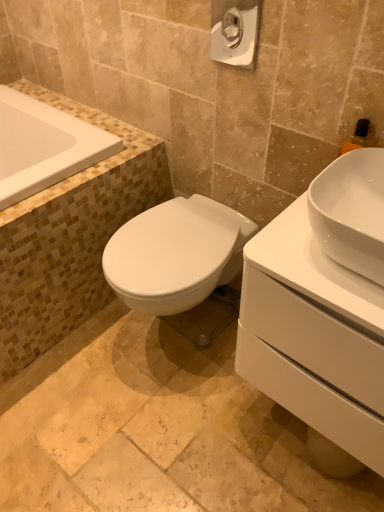
Question: Is white glossy sink at right positioned far away from white glossy toilet paper at upper center?

Choices:
 (A) no
 (B) yes

Answer: (A)

Question: Are white glossy sink at right and white glossy toilet paper at upper center making contact?

Choices:
 (A) yes
 (B) no

Answer: (B)

Question: Considering the relative sizes of white glossy sink at right and white glossy toilet paper at upper center in the image provided, is white glossy sink at right taller than white glossy toilet paper at upper center?

Choices:
 (A) no
 (B) yes

Answer: (A)

Question: From the image's perspective, does white glossy sink at right appear higher than white glossy toilet paper at upper center?

Choices:
 (A) yes
 (B) no

Answer: (B)

Question: Is white glossy toilet paper at upper center surrounded by white glossy sink at right?

Choices:
 (A) no
 (B) yes

Answer: (A)

Question: In terms of width, does white glossy bathtub at upper left look wider or thinner when compared to white glossy sink at right?

Choices:
 (A) wide
 (B) thin

Answer: (A)

Question: From a real-world perspective, relative to white glossy sink at right, is white glossy bathtub at upper left vertically above or below?

Choices:
 (A) above
 (B) below

Answer: (A)

Question: Do you think white glossy bathtub at upper left is within white glossy sink at right, or outside of it?

Choices:
 (A) outside
 (B) inside

Answer: (A)

Question: In terms of height, does white glossy bathtub at upper left look taller or shorter compared to white glossy sink at right?

Choices:
 (A) short
 (B) tall

Answer: (A)

Question: Considering the positions of white glossy bathtub at upper left and white glossy sink at right in the image, is white glossy bathtub at upper left taller or shorter than white glossy sink at right?

Choices:
 (A) tall
 (B) short

Answer: (B)

Question: Is white glossy bathtub at upper left to the left or to the right of white glossy sink at right in the image?

Choices:
 (A) right
 (B) left

Answer: (B)

Question: From the image's perspective, relative to white glossy sink at right, is white glossy bathtub at upper left above or below?

Choices:
 (A) above
 (B) below

Answer: (A)

Question: Considering the positions of point (31, 142) and point (336, 197), is point (31, 142) closer or farther from the camera than point (336, 197)?

Choices:
 (A) farther
 (B) closer

Answer: (A)

Question: Looking at their shapes, would you say white glossy sink at right is wider or thinner than white glossy bathtub at upper left?

Choices:
 (A) thin
 (B) wide

Answer: (A)

Question: From a real-world perspective, is white glossy sink at right above or below white glossy bathtub at upper left?

Choices:
 (A) below
 (B) above

Answer: (B)